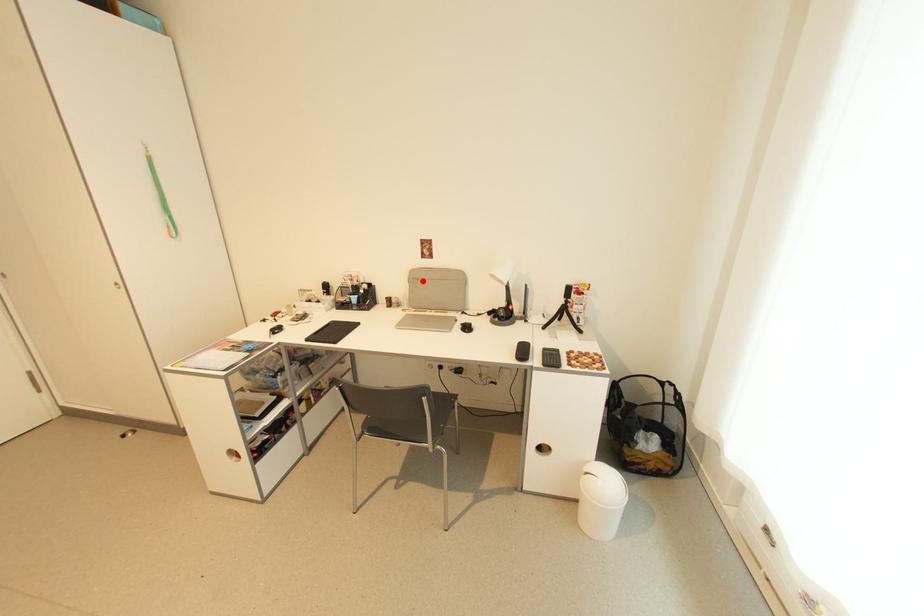
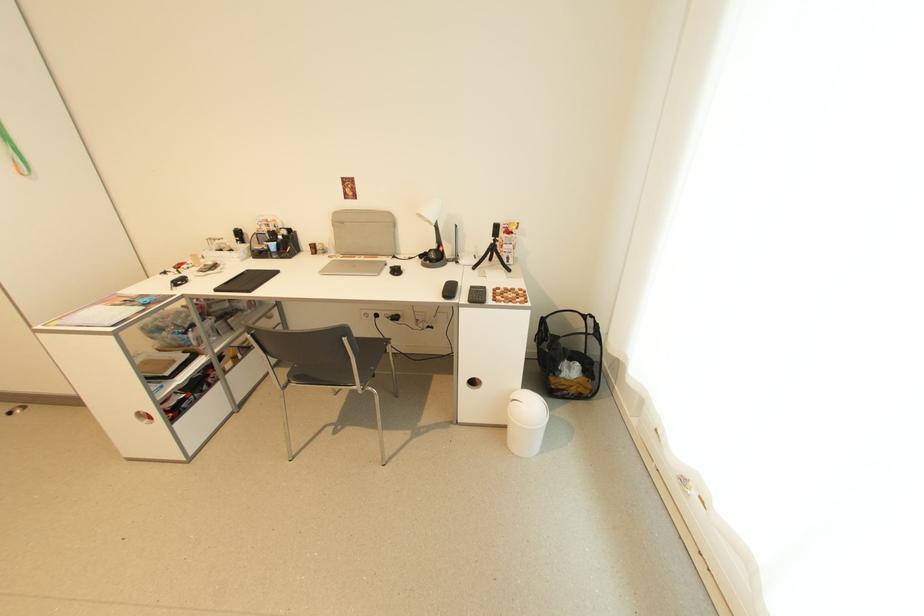
In the second image, find the point that corresponds to the highlighted location in the first image.

(347, 224)